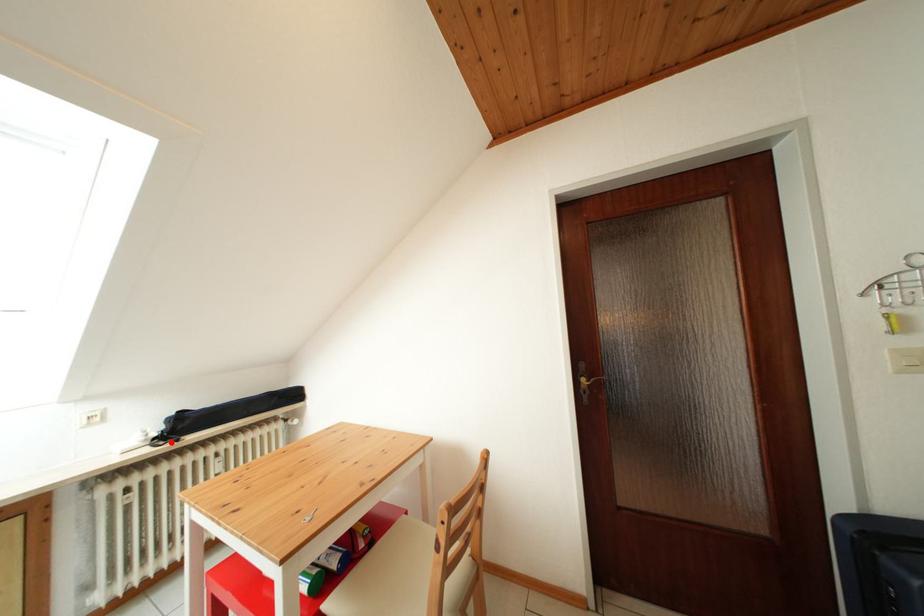
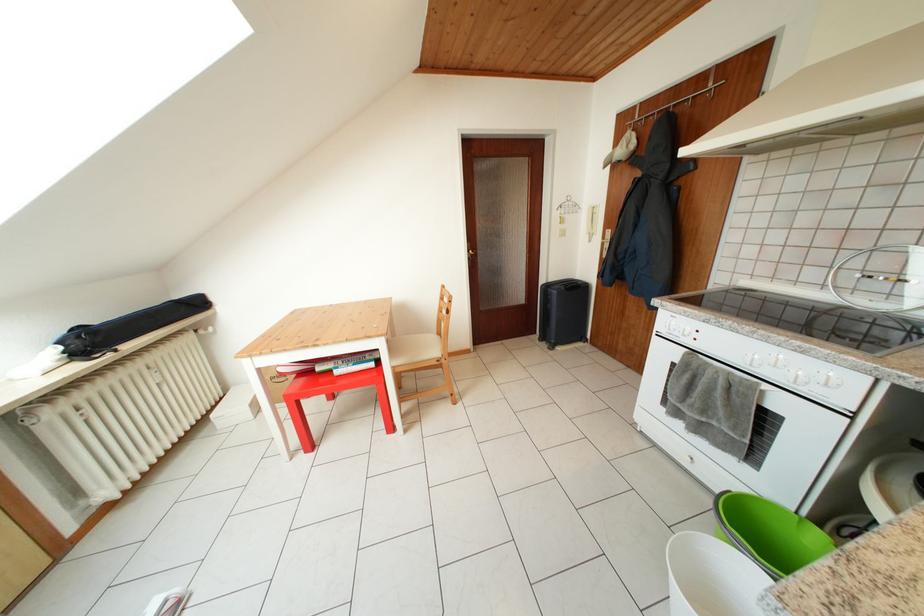
Question: I am providing you with two images of the same scene from different viewpoints. A red point is marked on the first image. Is the red point's position out of view in image 2?

Choices:
 (A) Yes
 (B) No

Answer: (B)